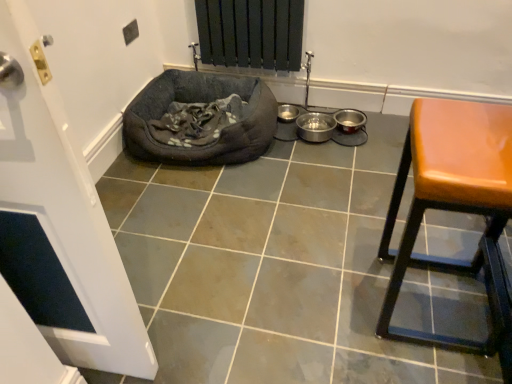
Question: Can you confirm if matte gray tile at center is smaller than dark gray fabric dog bed at lower left?

Choices:
 (A) yes
 (B) no

Answer: (B)

Question: Is dark gray fabric dog bed at lower left completely or partially inside matte gray tile at center?

Choices:
 (A) yes
 (B) no

Answer: (B)

Question: From a real-world perspective, is matte gray tile at center located beneath dark gray fabric dog bed at lower left?

Choices:
 (A) no
 (B) yes

Answer: (B)

Question: Can you confirm if matte gray tile at center is taller than dark gray fabric dog bed at lower left?

Choices:
 (A) yes
 (B) no

Answer: (B)

Question: Considering the relative sizes of matte gray tile at center and dark gray fabric dog bed at lower left in the image provided, is matte gray tile at center bigger than dark gray fabric dog bed at lower left?

Choices:
 (A) yes
 (B) no

Answer: (A)

Question: Considering their positions, is leatherette stool at right located in front of or behind matte gray tile at center?

Choices:
 (A) front
 (B) behind

Answer: (A)

Question: Would you say leatherette stool at right is to the left or to the right of matte gray tile at center in the picture?

Choices:
 (A) left
 (B) right

Answer: (B)

Question: From their relative heights in the image, would you say leatherette stool at right is taller or shorter than matte gray tile at center?

Choices:
 (A) tall
 (B) short

Answer: (A)

Question: Based on their sizes in the image, would you say leatherette stool at right is bigger or smaller than matte gray tile at center?

Choices:
 (A) big
 (B) small

Answer: (B)

Question: In terms of height, does dark gray fabric dog bed at lower left look taller or shorter compared to matte gray tile at center?

Choices:
 (A) short
 (B) tall

Answer: (B)

Question: Choose the correct answer: Is dark gray fabric dog bed at lower left inside matte gray tile at center or outside it?

Choices:
 (A) outside
 (B) inside

Answer: (A)

Question: Looking at the image, does dark gray fabric dog bed at lower left seem bigger or smaller compared to matte gray tile at center?

Choices:
 (A) big
 (B) small

Answer: (B)

Question: Relative to matte gray tile at center, is dark gray fabric dog bed at lower left in front or behind?

Choices:
 (A) behind
 (B) front

Answer: (A)

Question: Considering the positions of matte gray tile at center and dark gray fabric dog bed at lower left in the image, is matte gray tile at center wider or thinner than dark gray fabric dog bed at lower left?

Choices:
 (A) wide
 (B) thin

Answer: (A)

Question: Is matte gray tile at center bigger or smaller than dark gray fabric dog bed at lower left?

Choices:
 (A) big
 (B) small

Answer: (A)